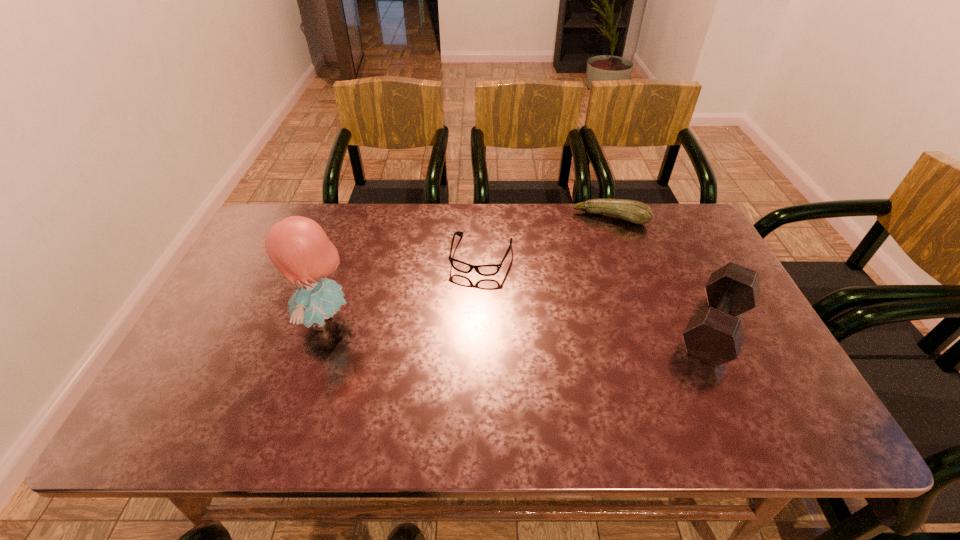
At what (x,y) coordinates should I click in order to perform the action: click on the tallest object. Please return your answer as a coordinate pair (x, y). This screenshot has height=540, width=960. Looking at the image, I should click on (x=299, y=248).

The height and width of the screenshot is (540, 960). I want to click on the leftmost object, so click(299, 248).

The height and width of the screenshot is (540, 960). I want to click on the second tallest object, so click(714, 335).

This screenshot has width=960, height=540. Find the location of `the shortest object`. the shortest object is located at coordinates (485, 270).

You are a GUI agent. You are given a task and a screenshot of the screen. Output one action in this format:
    pyautogui.click(x=<x>, y=<y>)
    Task: Click on the third nearest object
    The image size is (960, 540).
    Given the screenshot: What is the action you would take?
    pyautogui.click(x=485, y=270)

Where is `zucchini`? This screenshot has width=960, height=540. zucchini is located at coordinates (636, 212).

Locate an element on the screen. This screenshot has width=960, height=540. the farthest object is located at coordinates (636, 212).

Identify the location of free space located on the front-facing side of the doll. This screenshot has height=540, width=960. (218, 321).

Locate an element on the screen. vacant space situated 0.100m on the front-facing side of the doll is located at coordinates (256, 321).

This screenshot has width=960, height=540. I want to click on free space located on the front-facing side of the doll, so click(x=206, y=321).